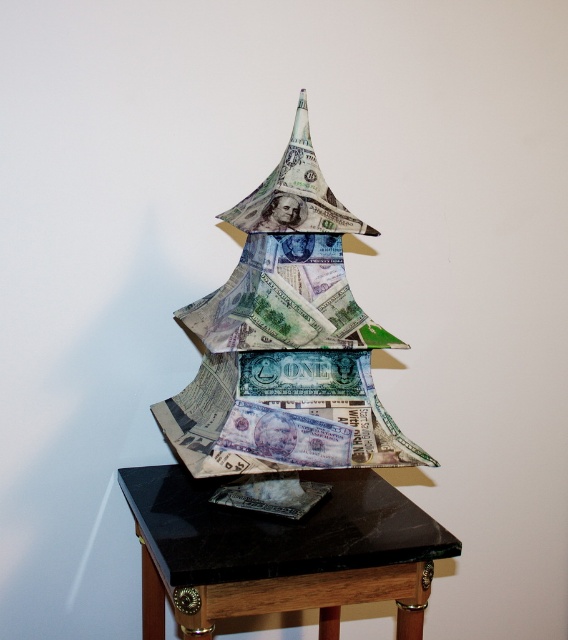
Who is taller, multi-colored paper money at center or black marble table at center?

Standing taller between the two is multi-colored paper money at center.

At what (x,y) coordinates should I click in order to perform the action: click on multi-colored paper money at center. Please return your answer as a coordinate pair (x, y). This screenshot has width=568, height=640. Looking at the image, I should click on (285, 342).